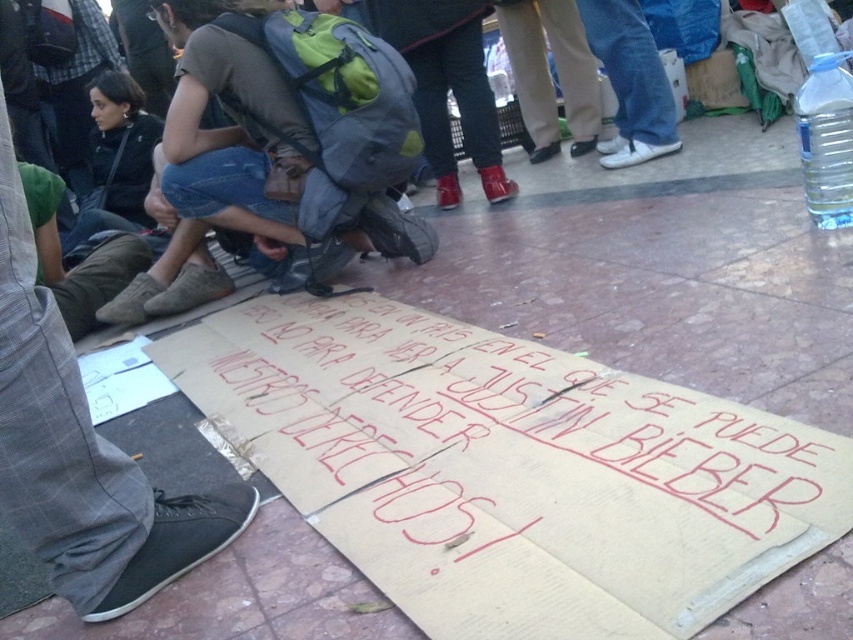
Question: Can you confirm if cardboard sign at lower center is positioned to the right of gray fabric backpack at center?

Choices:
 (A) yes
 (B) no

Answer: (A)

Question: Which of the following is the farthest from the observer?

Choices:
 (A) (639, 595)
 (B) (125, 484)

Answer: (B)

Question: Which object is the closest to the cardboard sign at lower center?

Choices:
 (A) gray fabric backpack at center
 (B) dark gray pants at lower left

Answer: (B)

Question: Is gray fabric backpack at center above dark gray pants at lower left?

Choices:
 (A) yes
 (B) no

Answer: (A)

Question: Is dark gray pants at lower left positioned at the back of clear plastic bottle at upper right?

Choices:
 (A) no
 (B) yes

Answer: (A)

Question: Among these points, which one is farthest from the camera?

Choices:
 (A) (646, 561)
 (B) (9, 467)
 (C) (845, 122)
 (D) (294, 60)

Answer: (D)